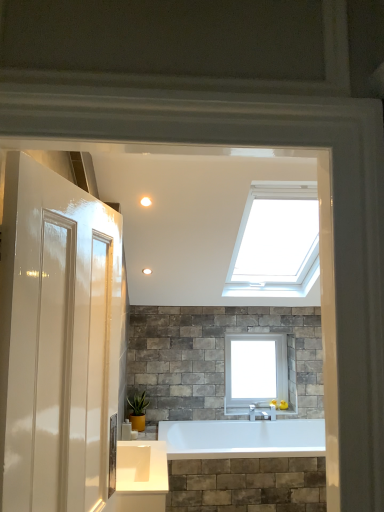
Question: Is green matte plant at lower center far away from matte white light fixture at upper center?

Choices:
 (A) yes
 (B) no

Answer: (A)

Question: From the image's perspective, does green matte plant at lower center appear lower than matte white light fixture at upper center?

Choices:
 (A) no
 (B) yes

Answer: (B)

Question: Is green matte plant at lower center to the right of matte white light fixture at upper center from the viewer's perspective?

Choices:
 (A) yes
 (B) no

Answer: (B)

Question: Is green matte plant at lower center surrounding matte white light fixture at upper center?

Choices:
 (A) no
 (B) yes

Answer: (A)

Question: Could you tell me if green matte plant at lower center is facing matte white light fixture at upper center?

Choices:
 (A) yes
 (B) no

Answer: (B)

Question: Considering the positions of white glass window at upper center and matte white light fixture at upper center in the image, is white glass window at upper center taller or shorter than matte white light fixture at upper center?

Choices:
 (A) short
 (B) tall

Answer: (B)

Question: From a real-world perspective, is white glass window at upper center above or below matte white light fixture at upper center?

Choices:
 (A) above
 (B) below

Answer: (B)

Question: Is white glass window at upper center situated inside matte white light fixture at upper center or outside?

Choices:
 (A) outside
 (B) inside

Answer: (A)

Question: Is white glass window at upper center in front of or behind matte white light fixture at upper center in the image?

Choices:
 (A) front
 (B) behind

Answer: (B)

Question: Is green matte plant at lower center in front of or behind matte white light fixture at upper center in the image?

Choices:
 (A) behind
 (B) front

Answer: (A)

Question: From the image's perspective, is green matte plant at lower center above or below matte white light fixture at upper center?

Choices:
 (A) below
 (B) above

Answer: (A)

Question: Would you say green matte plant at lower center is inside or outside matte white light fixture at upper center?

Choices:
 (A) inside
 (B) outside

Answer: (B)

Question: From a real-world perspective, is green matte plant at lower center physically located above or below matte white light fixture at upper center?

Choices:
 (A) above
 (B) below

Answer: (B)

Question: Would you say matte white light fixture at upper center is inside or outside green matte plant at lower center?

Choices:
 (A) outside
 (B) inside

Answer: (A)

Question: From their relative heights in the image, would you say matte white light fixture at upper center is taller or shorter than green matte plant at lower center?

Choices:
 (A) short
 (B) tall

Answer: (A)